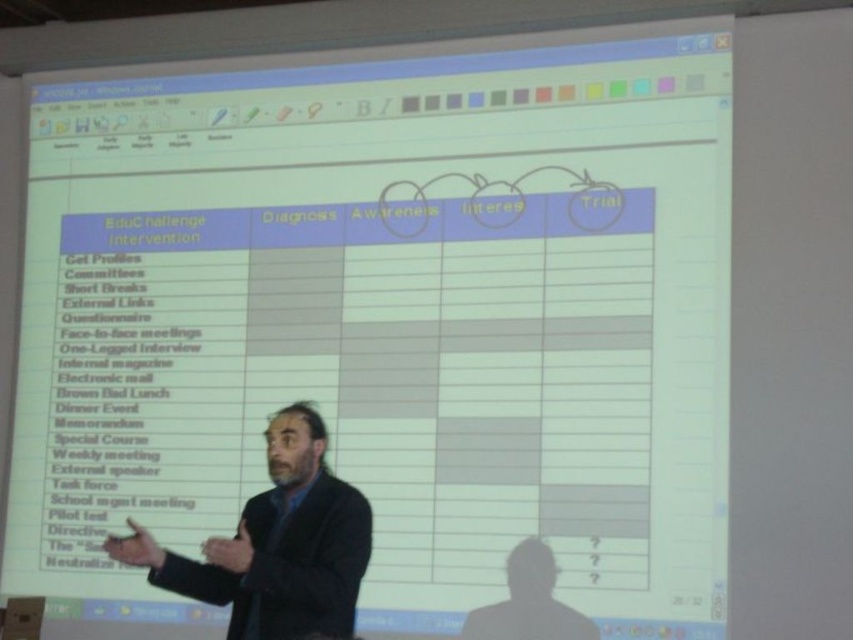
Does black suit at center appear on the left side of dark suit at center?

Indeed, black suit at center is positioned on the left side of dark suit at center.

Does black suit at center appear over dark suit at center?

Yes, black suit at center is above dark suit at center.

Where is `black suit at center`? The height and width of the screenshot is (640, 853). black suit at center is located at coordinates (276, 545).